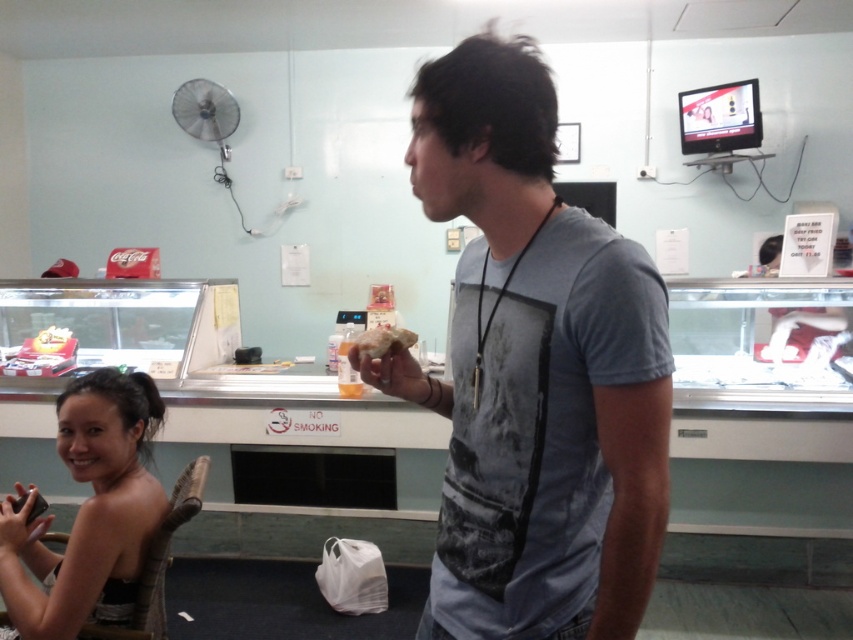
Question: Observing the image, what is the correct spatial positioning of brown crumbly bread at center in reference to matte yellow cake at center?

Choices:
 (A) below
 (B) above

Answer: (B)

Question: Which object appears closest to the camera in this image?

Choices:
 (A) brown crumbly bread at center
 (B) gray matte t-shirt at center
 (C) matte yellow cake at center

Answer: (B)

Question: Does gray matte t-shirt at center come in front of smooth black hair at lower left?

Choices:
 (A) yes
 (B) no

Answer: (A)

Question: Does gray matte t-shirt at center have a larger size compared to brown crumbly bread at center?

Choices:
 (A) no
 (B) yes

Answer: (B)

Question: Which object is closer to the camera taking this photo?

Choices:
 (A) brown crumbly bread at center
 (B) gray matte t-shirt at center

Answer: (B)

Question: Which of the following is the closest to the observer?

Choices:
 (A) coord(57,339)
 (B) coord(486,545)

Answer: (B)